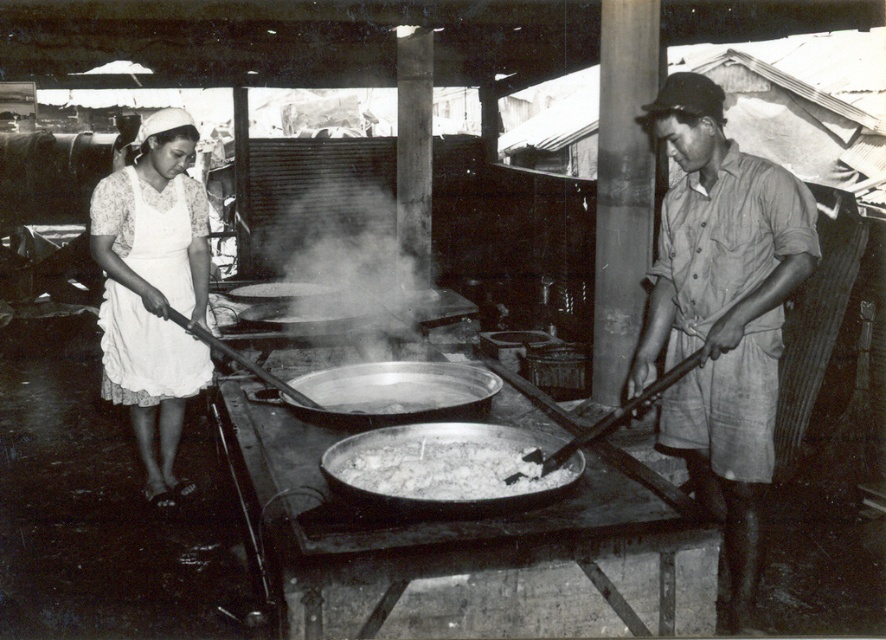
Based on the photo, does matte khaki shirt at right have a greater height compared to white fluffy rice at center?

Yes.

Who is more forward, [696,144] or [377,483]?

Point [377,483] is in front.

Between point (651, 312) and point (381, 454), which one is positioned behind?

The point (651, 312) is more distant.

The height and width of the screenshot is (640, 886). What are the coordinates of `matte khaki shirt at right` in the screenshot? It's located at (721, 310).

Does matte khaki shirt at right have a larger size compared to shiny metal wok at center?

Yes, matte khaki shirt at right is bigger than shiny metal wok at center.

Is matte khaki shirt at right smaller than shiny metal wok at center?

Incorrect, matte khaki shirt at right is not smaller in size than shiny metal wok at center.

Which is behind, point (719, 413) or point (336, 374)?

Positioned behind is point (336, 374).

Identify the location of matte khaki shirt at right. (721, 310).

Who is positioned more to the right, white apron at left or shiny metal wok at center?

From the viewer's perspective, shiny metal wok at center appears more on the right side.

Between white apron at left and shiny metal wok at center, which one appears on the left side from the viewer's perspective?

white apron at left

The width and height of the screenshot is (886, 640). What do you see at coordinates (153, 288) in the screenshot?
I see `white apron at left` at bounding box center [153, 288].

This screenshot has width=886, height=640. I want to click on white apron at left, so click(x=153, y=288).